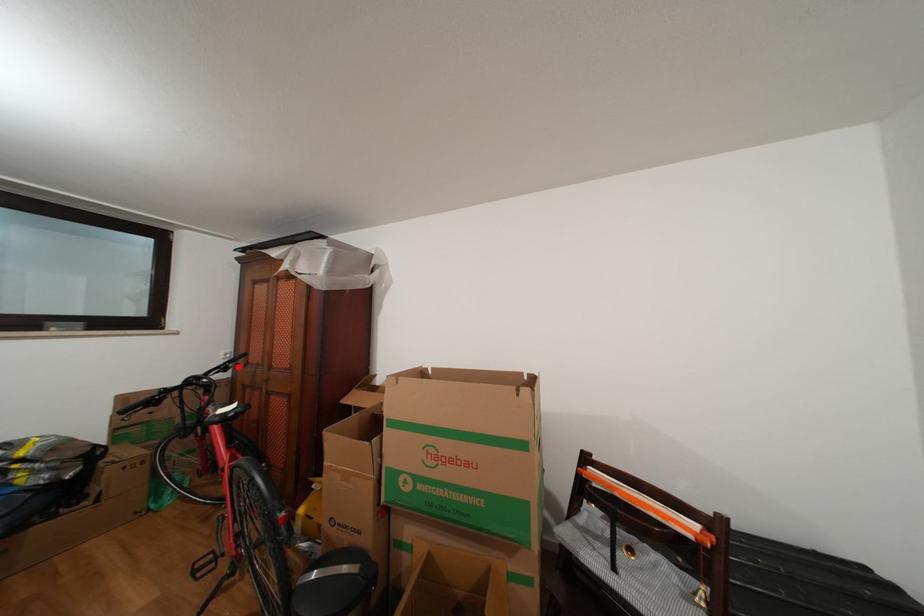
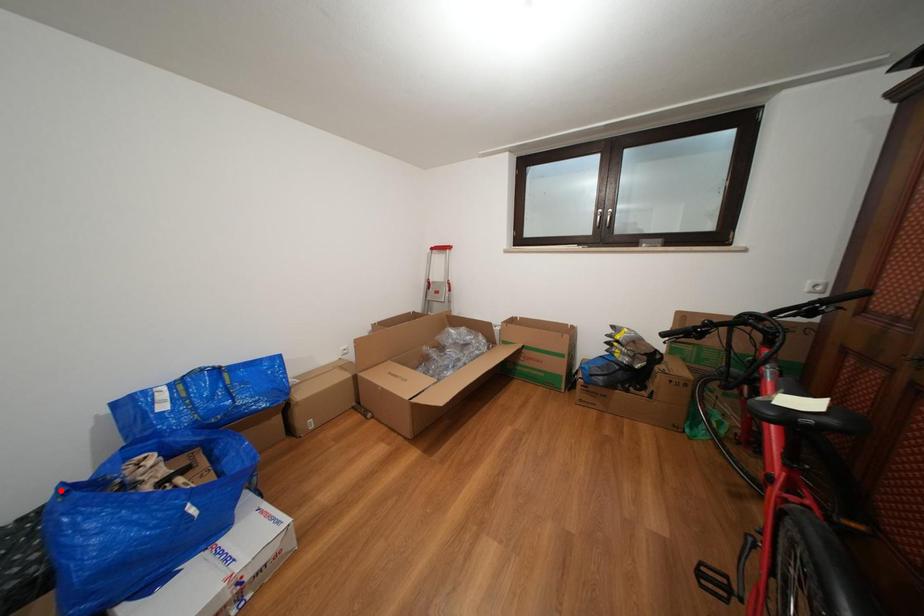
I am providing you with two images of the same scene from different viewpoints. A red point is marked on the first image and another point is marked on the second image. Is the marked point in image1 the same physical position as the marked point in image2?

No